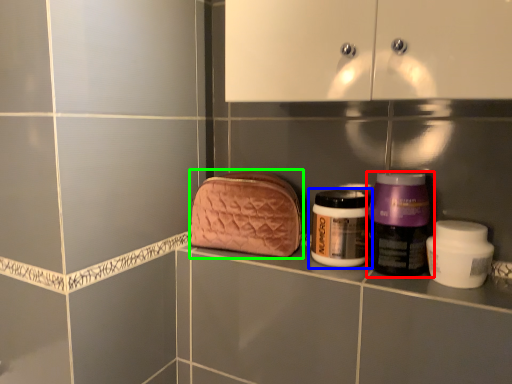
Question: Which is farther away from bottle (highlighted by a red box)? bottle (highlighted by a blue box) or pouch (highlighted by a green box)?

Choices:
 (A) bottle
 (B) pouch

Answer: (B)